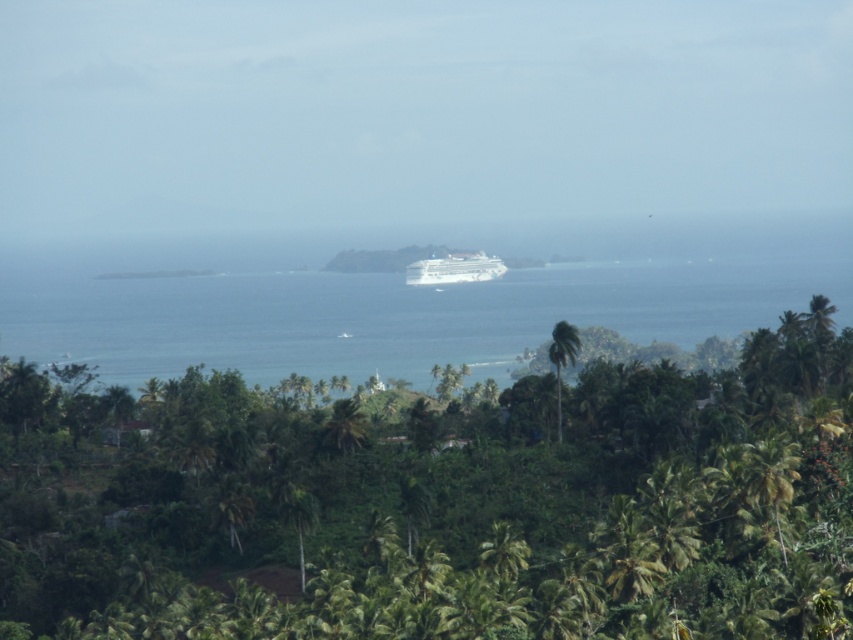
Question: Which of the following is the farthest from the observer?

Choices:
 (A) green leafy palm tree at center
 (B) blue water at center

Answer: (B)

Question: Which point is closer to the camera?

Choices:
 (A) (750, 308)
 (B) (444, 257)
 (C) (351, 616)
 (D) (556, 372)

Answer: (C)

Question: Is white glossy cruise ship at center positioned behind green leafy palm tree at center?

Choices:
 (A) yes
 (B) no

Answer: (A)

Question: Considering the relative positions of blue water at center and green leafy palm tree at center in the image provided, where is blue water at center located with respect to green leafy palm tree at center?

Choices:
 (A) right
 (B) left

Answer: (B)

Question: Is blue water at center below white glossy cruise ship at center?

Choices:
 (A) yes
 (B) no

Answer: (A)

Question: Which point appears farthest from the camera in this image?

Choices:
 (A) (606, 266)
 (B) (521, 444)

Answer: (A)